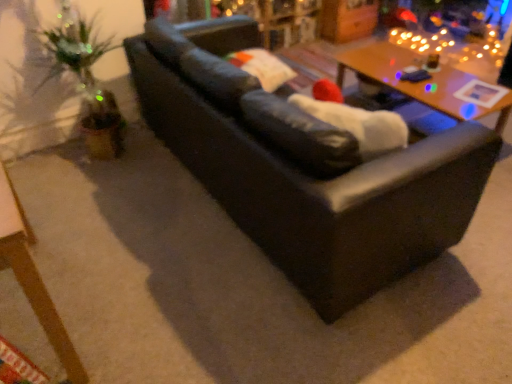
Identify the location of vacant space that is in between matte black couch at center and wooden table at lower left, the 1th table positioned from the front. The image size is (512, 384). 145,251.